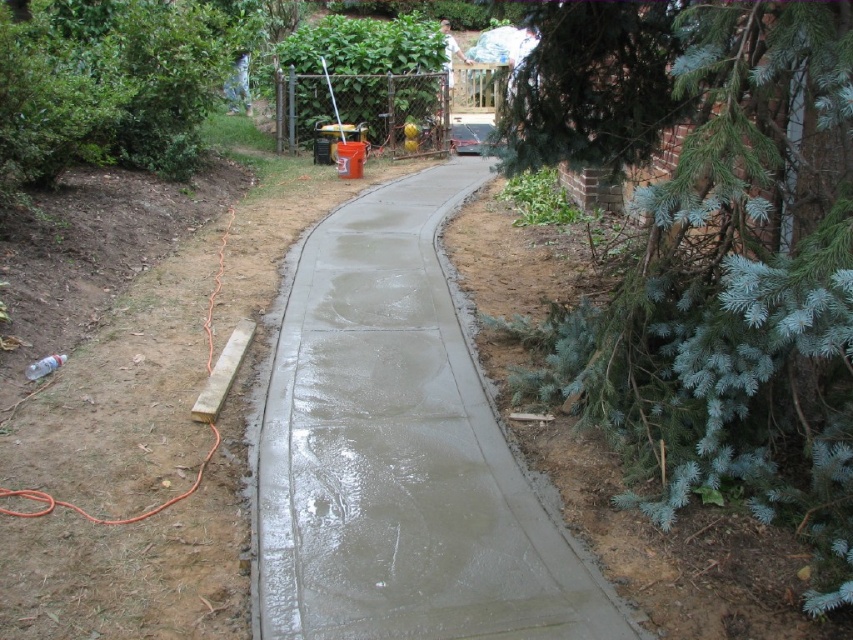
What do you see at coordinates (401, 452) in the screenshot?
I see `smooth concrete at center` at bounding box center [401, 452].

Who is more distant from viewer, (331, 508) or (18, 29)?

Positioned behind is point (18, 29).

Who is more distant from viewer, (474, 369) or (79, 150)?

The point (79, 150) is behind.

The image size is (853, 640). I want to click on smooth concrete at center, so click(x=401, y=452).

Which is in front, point (759, 339) or point (80, 28)?

Point (759, 339)

Does blue-green needles at right appear over green leafy bush at left?

Incorrect, blue-green needles at right is not positioned above green leafy bush at left.

Between point (743, 170) and point (215, 22), which one is positioned in front?

Positioned in front is point (743, 170).

The image size is (853, 640). What are the coordinates of `blue-green needles at right` in the screenshot? It's located at (720, 259).

Can you confirm if blue-green needles at right is shorter than smooth concrete at center?

In fact, blue-green needles at right may be taller than smooth concrete at center.

Which is in front, point (757, 225) or point (397, 452)?

Point (397, 452) is more forward.

Where is `blue-green needles at right`? Image resolution: width=853 pixels, height=640 pixels. blue-green needles at right is located at coordinates (720, 259).

This screenshot has width=853, height=640. I want to click on blue-green needles at right, so click(x=720, y=259).